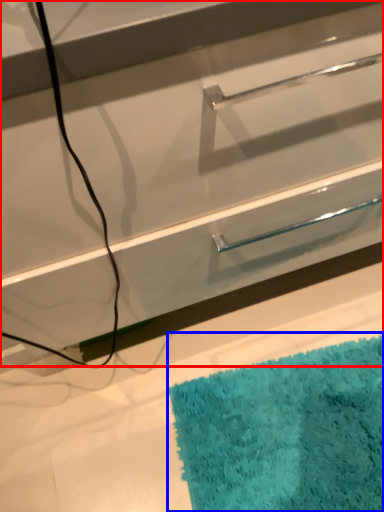
Question: Among these objects, which one is farthest to the camera, drawer (highlighted by a red box) or bath mat (highlighted by a blue box)?

Choices:
 (A) drawer
 (B) bath mat

Answer: (B)